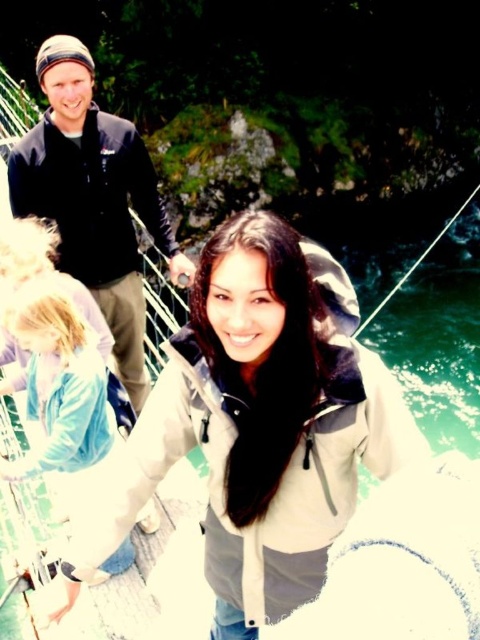
Question: Which point is farther from the camera taking this photo?

Choices:
 (A) (40, 195)
 (B) (219, 458)

Answer: (A)

Question: Is black matte jacket at upper left below light blue fabric jacket at lower left?

Choices:
 (A) yes
 (B) no

Answer: (B)

Question: Does light gray softshell jacket at center lie behind black matte jacket at upper left?

Choices:
 (A) no
 (B) yes

Answer: (A)

Question: Which object appears closest to the camera in this image?

Choices:
 (A) black matte jacket at upper left
 (B) light gray softshell jacket at center

Answer: (B)

Question: Does light gray softshell jacket at center appear under black matte jacket at upper left?

Choices:
 (A) yes
 (B) no

Answer: (A)

Question: Which point appears farthest from the camera in this image?

Choices:
 (A) (133, 500)
 (B) (67, 234)
 (C) (91, 420)

Answer: (B)